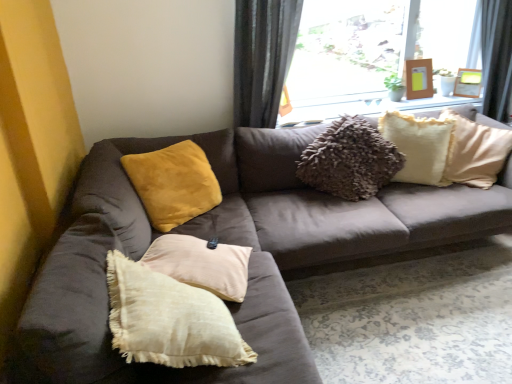
Question: Is there a large distance between wooden picture frame at upper right, the second picture frame when ordered from right to left, and velvet yellow pillow at upper left, the 1th pillow when ordered from left to right?

Choices:
 (A) no
 (B) yes

Answer: (B)

Question: Is velvet yellow pillow at upper left, marked as the 2th pillow in a right-to-left arrangement, located within wooden picture frame at upper right, which ranks as the 1th picture frame in left-to-right order?

Choices:
 (A) no
 (B) yes

Answer: (A)

Question: From a real-world perspective, is wooden picture frame at upper right, which ranks as the 1th picture frame in left-to-right order, positioned under velvet yellow pillow at upper left, the 1th pillow when ordered from left to right, based on gravity?

Choices:
 (A) yes
 (B) no

Answer: (B)

Question: Are wooden picture frame at upper right, which ranks as the 1th picture frame in left-to-right order, and velvet yellow pillow at upper left, the 1th pillow when ordered from left to right, making contact?

Choices:
 (A) no
 (B) yes

Answer: (A)

Question: From a real-world perspective, is wooden picture frame at upper right, which ranks as the 1th picture frame in left-to-right order, on velvet yellow pillow at upper left, marked as the 2th pillow in a right-to-left arrangement?

Choices:
 (A) yes
 (B) no

Answer: (A)

Question: Considering the relative positions of wooden picture frame at upper right, which ranks as the 1th picture frame in left-to-right order, and velvet yellow pillow at upper left, the 1th pillow when ordered from left to right, in the image provided, is wooden picture frame at upper right, which ranks as the 1th picture frame in left-to-right order, to the right of velvet yellow pillow at upper left, the 1th pillow when ordered from left to right, from the viewer's perspective?

Choices:
 (A) yes
 (B) no

Answer: (A)

Question: Considering the relative sizes of wooden picture frame at upper right, which ranks as the first picture frame in right-to-left order, and suede brown couch at center in the image provided, is wooden picture frame at upper right, which ranks as the first picture frame in right-to-left order, smaller than suede brown couch at center?

Choices:
 (A) yes
 (B) no

Answer: (A)

Question: Is wooden picture frame at upper right, which appears as the second picture frame when viewed from the left, bigger than suede brown couch at center?

Choices:
 (A) yes
 (B) no

Answer: (B)

Question: Is wooden picture frame at upper right, which appears as the second picture frame when viewed from the left, not close to suede brown couch at center?

Choices:
 (A) no
 (B) yes

Answer: (B)

Question: Is wooden picture frame at upper right, which ranks as the first picture frame in right-to-left order, wider than suede brown couch at center?

Choices:
 (A) yes
 (B) no

Answer: (B)

Question: Does wooden picture frame at upper right, which ranks as the first picture frame in right-to-left order, have a lesser width compared to suede brown couch at center?

Choices:
 (A) yes
 (B) no

Answer: (A)

Question: From the image's perspective, is wooden picture frame at upper right, which appears as the second picture frame when viewed from the left, over suede brown couch at center?

Choices:
 (A) yes
 (B) no

Answer: (A)

Question: Does transparent glass window at upper center have a smaller size compared to wooden picture frame at upper right, the second picture frame when ordered from right to left?

Choices:
 (A) yes
 (B) no

Answer: (B)